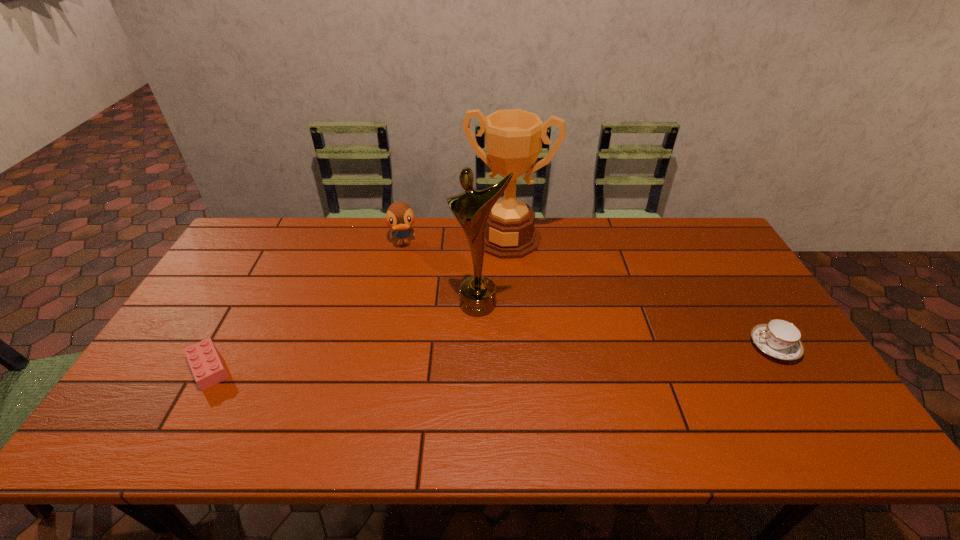
Identify the location of Lego. (206, 365).

You are a GUI agent. You are given a task and a screenshot of the screen. Output one action in this format:
    pyautogui.click(x=<x>, y=<y>)
    Task: Click on the leftmost object
    The image size is (960, 540).
    Given the screenshot: What is the action you would take?
    pyautogui.click(x=206, y=365)

Image resolution: width=960 pixels, height=540 pixels. Identify the location of teacup. (780, 339).

This screenshot has width=960, height=540. In order to click on the rightmost object in this screenshot , I will do `click(780, 339)`.

Locate an element on the screen. The image size is (960, 540). the farther award is located at coordinates (513, 137).

What are the coordinates of `the third shortest object` in the screenshot? It's located at (399, 216).

Image resolution: width=960 pixels, height=540 pixels. Find the location of `the fourth object from right to left`. the fourth object from right to left is located at coordinates (399, 216).

Where is `the third nearest object`? This screenshot has width=960, height=540. the third nearest object is located at coordinates (471, 208).

Where is `vacant space located 0.210m on the back of the shortest object`? The width and height of the screenshot is (960, 540). vacant space located 0.210m on the back of the shortest object is located at coordinates (252, 292).

Find the location of a particular element. The image size is (960, 540). free space located on the side with the handle of the second shortest object is located at coordinates (716, 347).